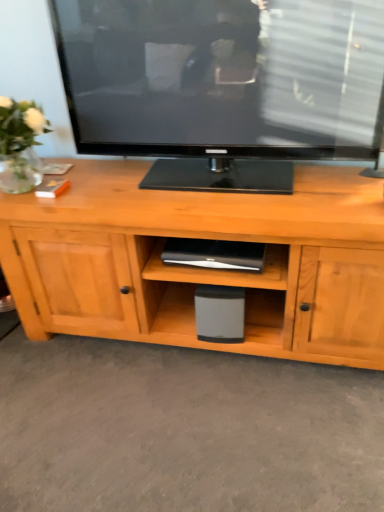
Question: Is clear glass vase at left to the right of gray matte speaker at center from the viewer's perspective?

Choices:
 (A) no
 (B) yes

Answer: (A)

Question: Is the position of clear glass vase at left less distant than that of gray matte speaker at center?

Choices:
 (A) yes
 (B) no

Answer: (A)

Question: Is clear glass vase at left bigger than gray matte speaker at center?

Choices:
 (A) no
 (B) yes

Answer: (B)

Question: From a real-world perspective, is clear glass vase at left located beneath gray matte speaker at center?

Choices:
 (A) no
 (B) yes

Answer: (A)

Question: Can you confirm if clear glass vase at left is smaller than gray matte speaker at center?

Choices:
 (A) yes
 (B) no

Answer: (B)

Question: Can you confirm if clear glass vase at left is wider than gray matte speaker at center?

Choices:
 (A) no
 (B) yes

Answer: (B)

Question: Is gray matte speaker at center wider than clear glass vase at left?

Choices:
 (A) no
 (B) yes

Answer: (A)

Question: From the image's perspective, is gray matte speaker at center located above clear glass vase at left?

Choices:
 (A) no
 (B) yes

Answer: (A)

Question: Is gray matte speaker at center outside of clear glass vase at left?

Choices:
 (A) no
 (B) yes

Answer: (B)

Question: Does gray matte speaker at center have a smaller size compared to clear glass vase at left?

Choices:
 (A) yes
 (B) no

Answer: (A)

Question: Does gray matte speaker at center come in front of clear glass vase at left?

Choices:
 (A) no
 (B) yes

Answer: (A)

Question: Considering the relative sizes of gray matte speaker at center and clear glass vase at left in the image provided, is gray matte speaker at center thinner than clear glass vase at left?

Choices:
 (A) no
 (B) yes

Answer: (B)

Question: Considering the relative positions of clear glass vase at left and gray matte speaker at center in the image provided, is clear glass vase at left to the left or to the right of gray matte speaker at center?

Choices:
 (A) left
 (B) right

Answer: (A)